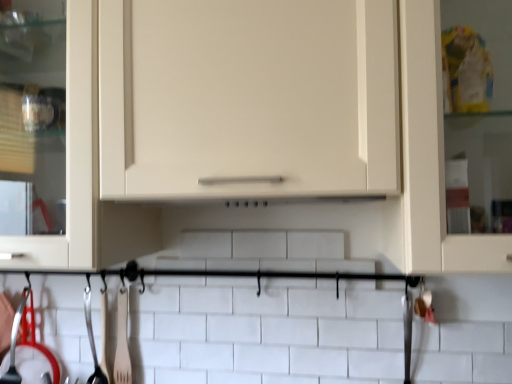
Question: From a real-world perspective, is wooden fork at lower left, which appears as the first silverware when viewed from the right, positioned above or below shiny metallic spoon at lower left, which is counted as the 2th silverware, starting from the left?

Choices:
 (A) above
 (B) below

Answer: (A)

Question: From the image's perspective, is wooden fork at lower left, which appears as the first silverware when viewed from the right, positioned above or below shiny metallic spoon at lower left, which is counted as the 3th silverware, starting from the right?

Choices:
 (A) below
 (B) above

Answer: (B)

Question: Estimate the real-world distances between objects in this image. Which object is farther from the polished metal ladle at lower left, the 1th silverware from the left?

Choices:
 (A) wooden fork at lower left, the 4th silverware when ordered from left to right
 (B) matte white cabinet at center
 (C) polished metal spatula at lower left, positioned as the 3th silverware in left-to-right order
 (D) shiny metallic spoon at lower left, which is counted as the 3th silverware, starting from the right

Answer: (B)

Question: Which is nearer to the polished metal spatula at lower left, positioned as the 3th silverware in left-to-right order?

Choices:
 (A) shiny metallic spoon at lower left, which is counted as the 2th silverware, starting from the left
 (B) wooden fork at lower left, the 4th silverware when ordered from left to right
 (C) matte white cabinet at center
 (D) polished metal ladle at lower left, the 1th silverware from the left

Answer: (B)